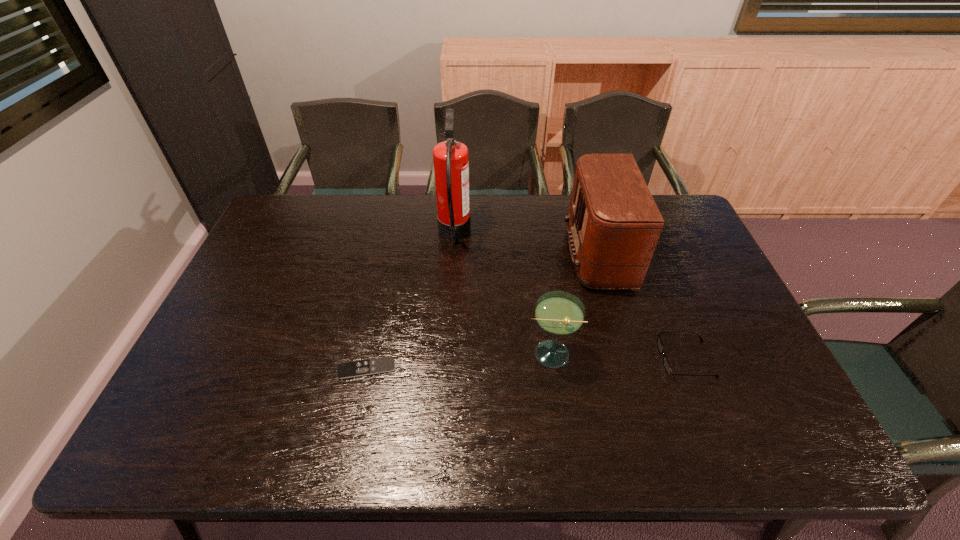
The image size is (960, 540). I want to click on spectacles that is at the right edge, so click(667, 366).

I want to click on object present at the far right corner, so click(x=614, y=224).

I want to click on vacant space at the far edge of the desktop, so click(x=500, y=230).

Locate an element on the screen. vacant region at the near edge of the desktop is located at coordinates (726, 440).

In the image, there is a desktop. Where is `vacant area at the left edge`? This screenshot has height=540, width=960. vacant area at the left edge is located at coordinates (254, 356).

Find the location of a particular element. This screenshot has height=540, width=960. vacant space at the right edge of the desktop is located at coordinates click(702, 241).

This screenshot has width=960, height=540. Find the location of `free space at the near left corner of the desktop`. free space at the near left corner of the desktop is located at coordinates (178, 443).

At what (x,y) coordinates should I click in order to perform the action: click on free location at the far right corner. Please return your answer as a coordinate pair (x, y). The height and width of the screenshot is (540, 960). Looking at the image, I should click on (681, 230).

Where is `vacant space at the near right corner of the desktop`? vacant space at the near right corner of the desktop is located at coordinates (789, 447).

Locate an element on the screen. free space between the third object from right to left and the fourth tallest object is located at coordinates (617, 356).